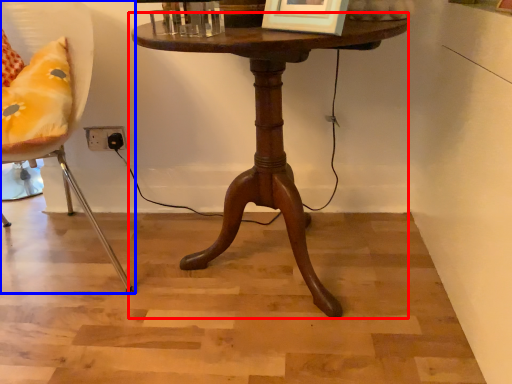
Question: Which of the following is the closest to the observer, table (highlighted by a red box) or chair (highlighted by a blue box)?

Choices:
 (A) table
 (B) chair

Answer: (B)